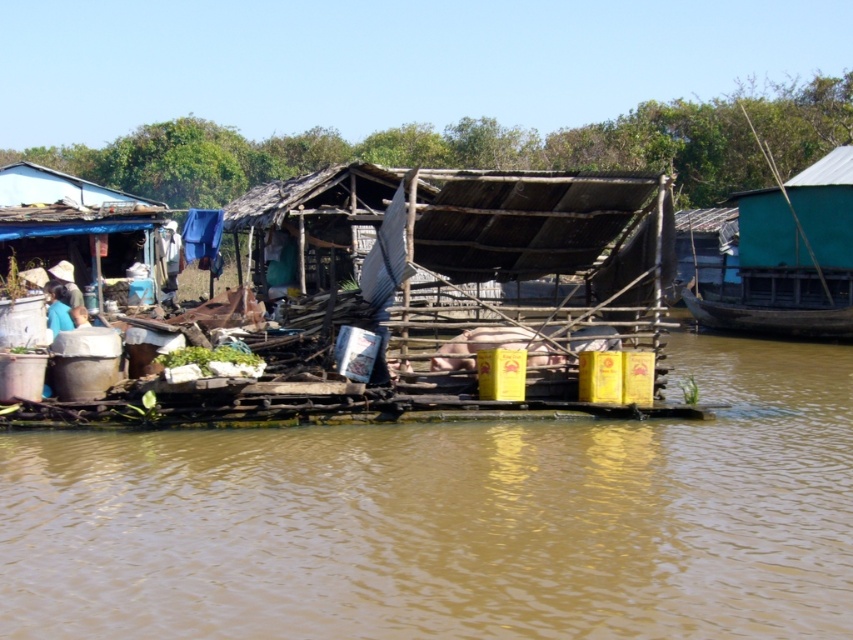
Is point (363, 582) farther from viewer compared to point (822, 221)?

No, it is not.

Is point (126, 557) less distant than point (756, 221)?

Yes, it is in front of point (756, 221).

In order to click on brown muddy water at center in this screenshot , I will do `click(451, 520)`.

Can you confirm if green corrugated metal boat at right is positioned to the right of rusty corrugated metal hut at left?

Indeed, green corrugated metal boat at right is positioned on the right side of rusty corrugated metal hut at left.

Between green corrugated metal boat at right and rusty corrugated metal hut at left, which one appears on the left side from the viewer's perspective?

rusty corrugated metal hut at left is more to the left.

Which is in front, point (838, 321) or point (13, 209)?

Point (13, 209) is more forward.

Where is `green corrugated metal boat at right`? green corrugated metal boat at right is located at coordinates (791, 257).

Does brown muddy water at center have a lesser height compared to rusty corrugated metal hut at left?

Correct, brown muddy water at center is not as tall as rusty corrugated metal hut at left.

Based on the photo, is brown muddy water at center positioned behind rusty corrugated metal hut at left?

That is False.

Who is more distant from viewer, (38, 621) or (45, 212)?

Positioned behind is point (45, 212).

Find the location of a particular element. The image size is (853, 640). brown muddy water at center is located at coordinates (451, 520).